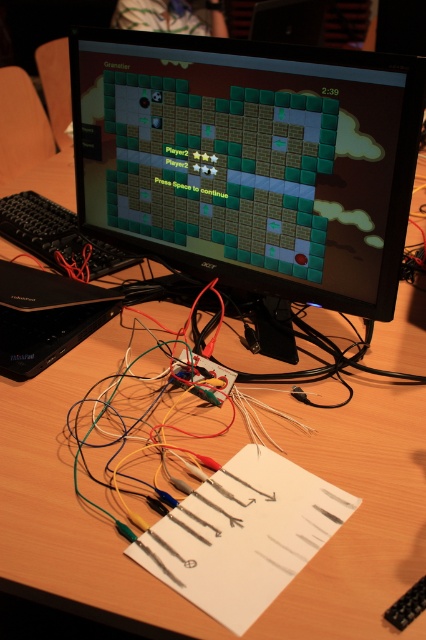
You are setting up a new desk and want to place the black plastic laptop at center and the black plastic keyboard at left in a way that they don not overlap. Given their thickness, which one should you place closer to the edge of the desk?

The black plastic laptop at center is thinner than the black plastic keyboard at left, so you should place the black plastic laptop at center closer to the edge of the desk since it takes up less space.